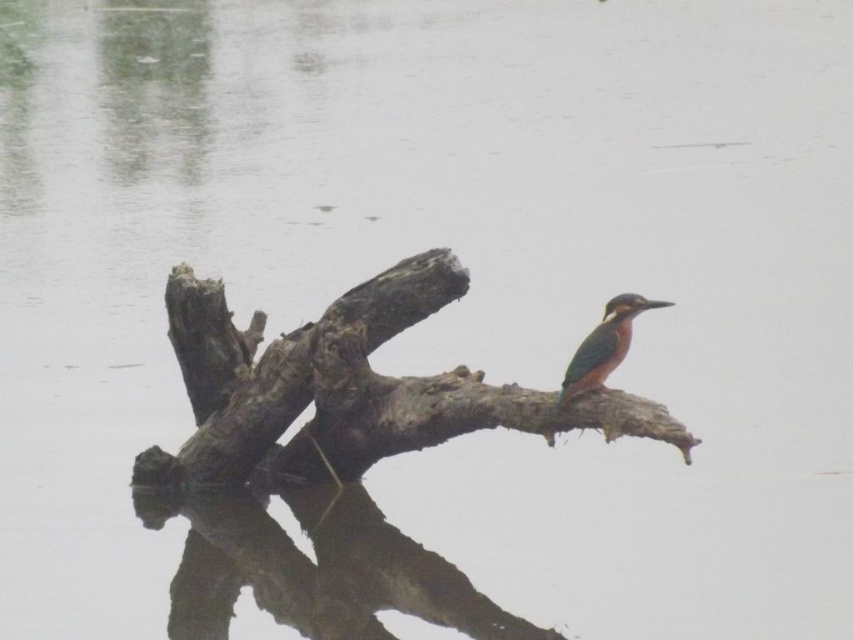
You are standing at the camera position and want to throw a small pebble to hit the point at coordinates point (346,388). If you can throw a pebble up to 7 meters, will you be able to reach that point?

The point (346,388) is 7.20 meters from the camera, which is beyond your throwing range of 7 meters. Therefore, you cannot reach it with a single throw.

You are a birdwatcher trying to locate the kingfisher in the image. The kingfisher is perched on a specific point marked as point (367, 385). Where exactly is this point located in the scene?

The point (367, 385) is located on the rough bark branch at center.

You are a photographer aiming to capture the green glossy bird at center and the rough bark branch at center in a single shot. Based on their positions, which object should you adjust your camera focus on first if you want to ensure both are in focus?

The rough bark branch at center is positioned on the left side of green glossy bird at center, so you should focus on the rough bark branch at center first to ensure both are in focus.